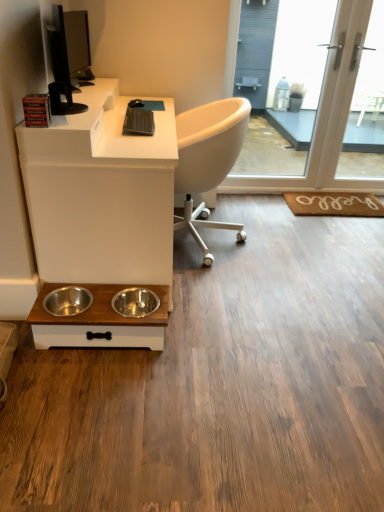
In order to click on blank space situated above brown woven mat at lower right (from a real-world perspective) in this screenshot , I will do 339,200.